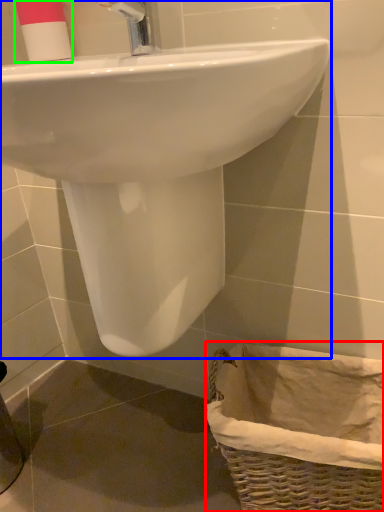
Question: Which object is positioned farthest from basket (highlighted by a red box)? Select from sink (highlighted by a blue box) and toiletry (highlighted by a green box).

Choices:
 (A) sink
 (B) toiletry

Answer: (B)